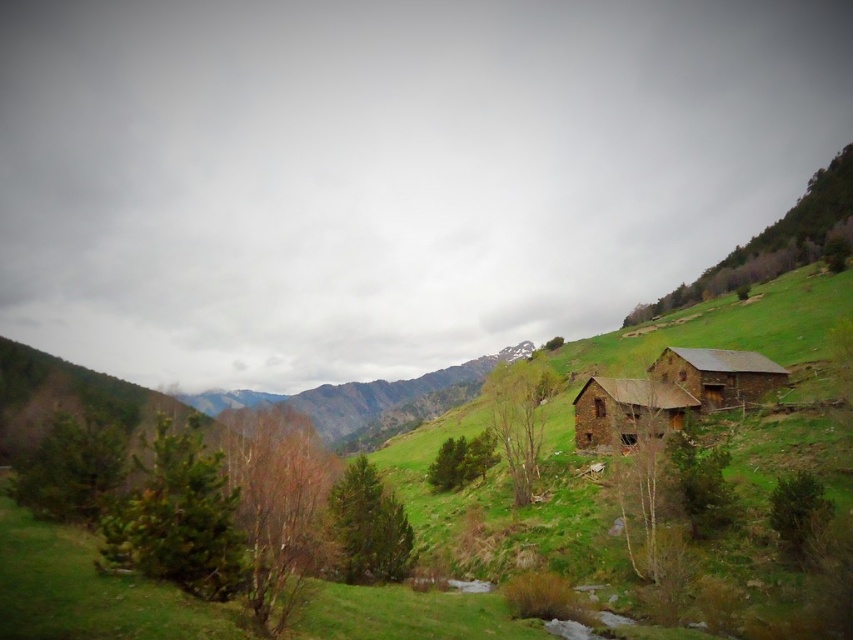
Question: Does rustic stone hut at center have a larger size compared to brown wooden hut at right?

Choices:
 (A) yes
 (B) no

Answer: (A)

Question: From the image, what is the correct spatial relationship of rustic stone hut at center in relation to brown wooden hut at right?

Choices:
 (A) below
 (B) above

Answer: (A)

Question: Which of the following is the closest to the observer?

Choices:
 (A) (650, 397)
 (B) (730, 384)

Answer: (A)

Question: Is rustic stone hut at center bigger than brown wooden hut at right?

Choices:
 (A) no
 (B) yes

Answer: (B)